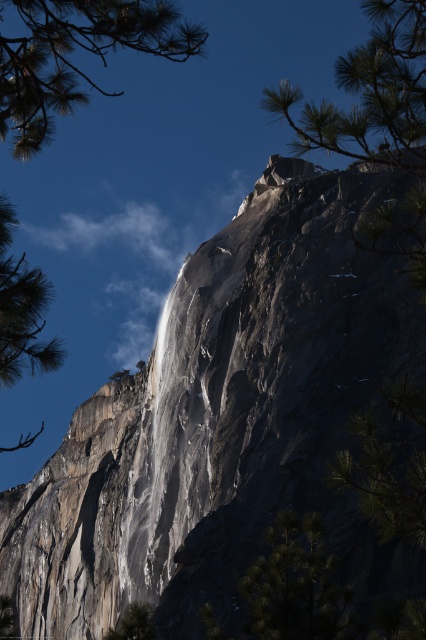
Is green pine branch at upper left below green textured tree at lower center?

No.

Which is more to the right, green pine branch at upper left or green textured tree at lower center?

green textured tree at lower center

Is point (109, 20) positioned before point (138, 627)?

Yes.

What are the coordinates of `green pine branch at upper left` in the screenshot? It's located at (72, 51).

Can you confirm if green textured rock at upper center is bigger than green pine branch at upper left?

No.

Which of these two, green textured rock at upper center or green pine branch at upper left, stands shorter?

With less height is green textured rock at upper center.

Between point (393, 104) and point (108, 26), which one is positioned behind?

The point (108, 26) is more distant.

Image resolution: width=426 pixels, height=640 pixels. I want to click on green textured rock at upper center, so click(371, 93).

Does green textured pine tree at left lie behind green textured tree at lower center?

That is False.

Does green textured pine tree at left have a smaller size compared to green textured tree at lower center?

No, green textured pine tree at left is not smaller than green textured tree at lower center.

The image size is (426, 640). What are the coordinates of `green textured pine tree at left` in the screenshot? It's located at (22, 308).

Locate an element on the screen. The height and width of the screenshot is (640, 426). green textured pine tree at left is located at coordinates (22, 308).